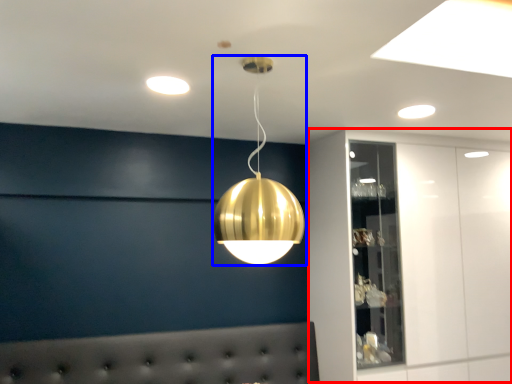
Question: Which object is further to the camera taking this photo, dresser (highlighted by a red box) or lamp (highlighted by a blue box)?

Choices:
 (A) dresser
 (B) lamp

Answer: (A)